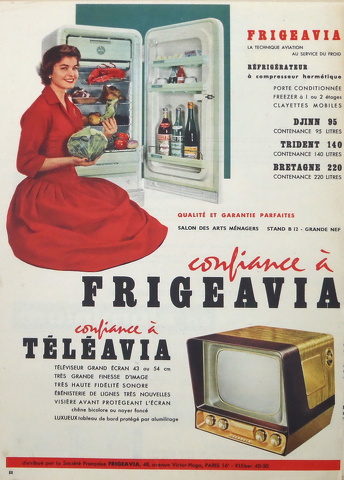
Locate an element on the screen. This screenshot has height=480, width=344. television screen is located at coordinates (224, 372).